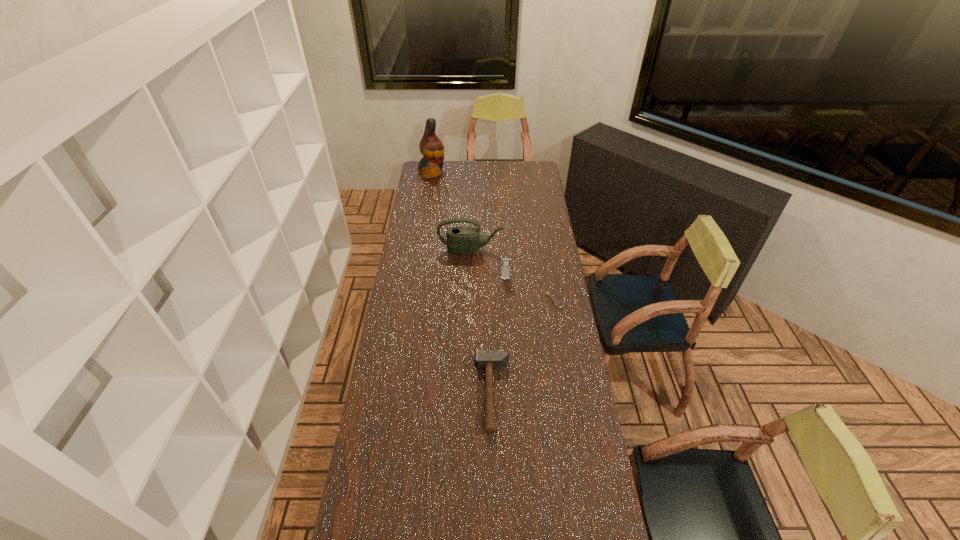
Identify the location of unoccupied area between the farthest object and the cellular telephone. The height and width of the screenshot is (540, 960). (468, 226).

Where is `empty location between the leftmost object and the fourth nearest object`? This screenshot has width=960, height=540. empty location between the leftmost object and the fourth nearest object is located at coordinates (451, 211).

I want to click on vacant point located between the fourth tallest object and the parrot, so click(x=462, y=284).

Identify the location of free space between the hammer and the leftmost object. (462, 284).

Find the location of a particular element. the closest object relative to the fourth nearest object is located at coordinates (505, 268).

Where is `the second closest object to the second tallest object`? This screenshot has height=540, width=960. the second closest object to the second tallest object is located at coordinates (558, 304).

Where is `blank area in the image that satisfies the following two spatial constraints: 1. on the front-facing side of the cellular telephone; 2. on the right side of the watch`? blank area in the image that satisfies the following two spatial constraints: 1. on the front-facing side of the cellular telephone; 2. on the right side of the watch is located at coordinates 507,300.

At what (x,y) coordinates should I click in order to perform the action: click on free location that satisfies the following two spatial constraints: 1. on the front-facing side of the cellular telephone; 2. on the striking surface of the second shortest object. Please return your answer as a coordinate pair (x, y). This screenshot has height=540, width=960. Looking at the image, I should click on (512, 394).